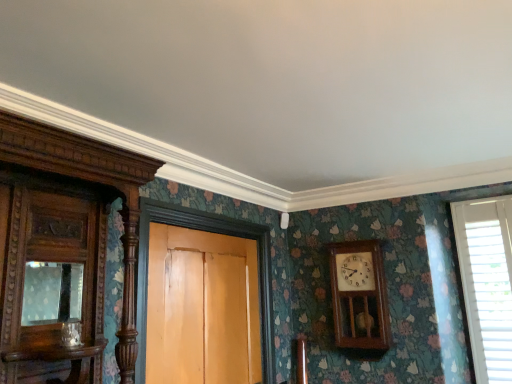
Question: Could matte glass mirror at left be considered to be inside wooden wall clock at center-right?

Choices:
 (A) no
 (B) yes

Answer: (A)

Question: Considering the relative sizes of wooden wall clock at center-right and matte glass mirror at left in the image provided, is wooden wall clock at center-right taller than matte glass mirror at left?

Choices:
 (A) yes
 (B) no

Answer: (A)

Question: Can you confirm if wooden wall clock at center-right is positioned to the right of matte glass mirror at left?

Choices:
 (A) no
 (B) yes

Answer: (B)

Question: Could you tell me if wooden wall clock at center-right is turned towards matte glass mirror at left?

Choices:
 (A) no
 (B) yes

Answer: (B)

Question: Are wooden wall clock at center-right and matte glass mirror at left making contact?

Choices:
 (A) yes
 (B) no

Answer: (B)

Question: Looking at the image, does polished wood cabinet at left seem bigger or smaller compared to white plastic blinds at right?

Choices:
 (A) small
 (B) big

Answer: (B)

Question: From the image's perspective, is polished wood cabinet at left above or below white plastic blinds at right?

Choices:
 (A) above
 (B) below

Answer: (A)

Question: Is point (50, 129) positioned closer to the camera than point (498, 281)?

Choices:
 (A) closer
 (B) farther

Answer: (A)

Question: Choose the correct answer: Is polished wood cabinet at left inside white plastic blinds at right or outside it?

Choices:
 (A) inside
 (B) outside

Answer: (B)

Question: Considering the positions of polished wood cabinet at left and wooden door at center in the image, is polished wood cabinet at left wider or thinner than wooden door at center?

Choices:
 (A) wide
 (B) thin

Answer: (A)

Question: From the image's perspective, is polished wood cabinet at left positioned above or below wooden door at center?

Choices:
 (A) below
 (B) above

Answer: (B)

Question: Do you think polished wood cabinet at left is within wooden door at center, or outside of it?

Choices:
 (A) outside
 (B) inside

Answer: (A)

Question: Based on their positions, is polished wood cabinet at left located to the left or right of wooden door at center?

Choices:
 (A) left
 (B) right

Answer: (A)

Question: Does point (490, 312) appear closer or farther from the camera than point (152, 364)?

Choices:
 (A) closer
 (B) farther

Answer: (B)

Question: Choose the correct answer: Is white plastic blinds at right inside wooden door at center or outside it?

Choices:
 (A) inside
 (B) outside

Answer: (B)